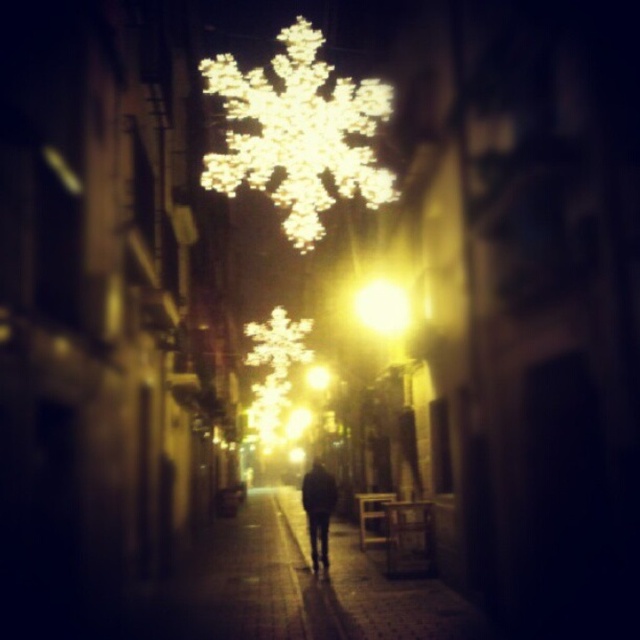
You are standing at the entrance of the street and want to walk to the smooth stone pavement at center. According to the image, in which direction should you move relative to the street?

The smooth stone pavement at center is located at point (310,582), so you should move forward along the street towards the center to reach it.

Looking at this image, you are standing at the entrance of the street and want to take a photo of the yellow matte light at center. Which direction should you face to ensure the light is in the center of your photo?

The yellow matte light at center is located at point (381, 307), so you should face directly towards the center of the street to capture it in the center of your photo.